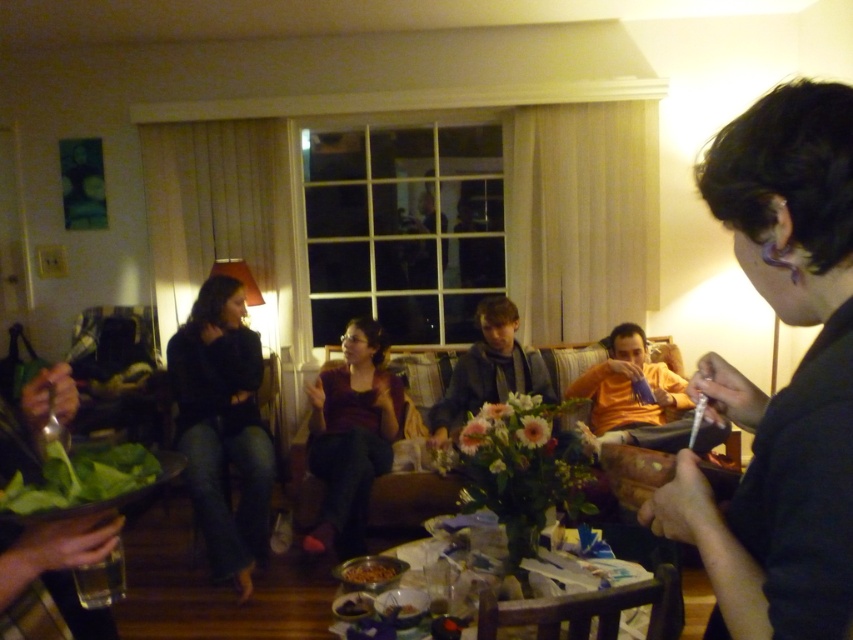
Question: Estimate the real-world distances between objects in this image. Which object is farther from the black matte jeans at left?

Choices:
 (A) brown matte bowl at lower center
 (B) black fabric shirt at right

Answer: (B)

Question: Is black matte jeans at left bigger than matte purple sweater at center?

Choices:
 (A) yes
 (B) no

Answer: (A)

Question: Is matte purple sweater at center below smooth plastic bowl at lower center?

Choices:
 (A) no
 (B) yes

Answer: (A)

Question: Which object is closer to the camera taking this photo?

Choices:
 (A) green leafy vegetable at lower left
 (B) dark gray sweater at center
 (C) black fabric shirt at right

Answer: (C)

Question: Does orange cotton shirt at center have a greater width compared to green leafy vegetable at lower left?

Choices:
 (A) yes
 (B) no

Answer: (A)

Question: Which of the following is the farthest from the observer?

Choices:
 (A) green leafy vegetable at lower left
 (B) black fabric shirt at right
 (C) orange cotton shirt at center
 (D) smooth chocolate bar at lower center

Answer: (C)